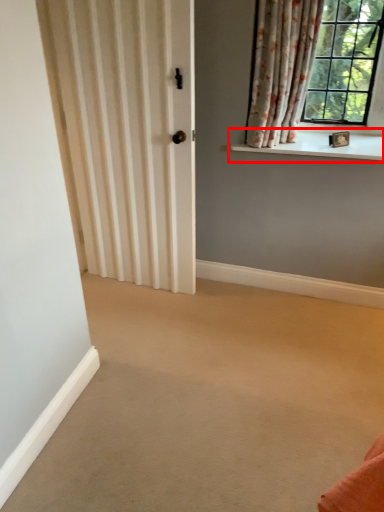
Question: In this image, where is window sill (annotated by the red box) located relative to curtain?

Choices:
 (A) right
 (B) left

Answer: (A)